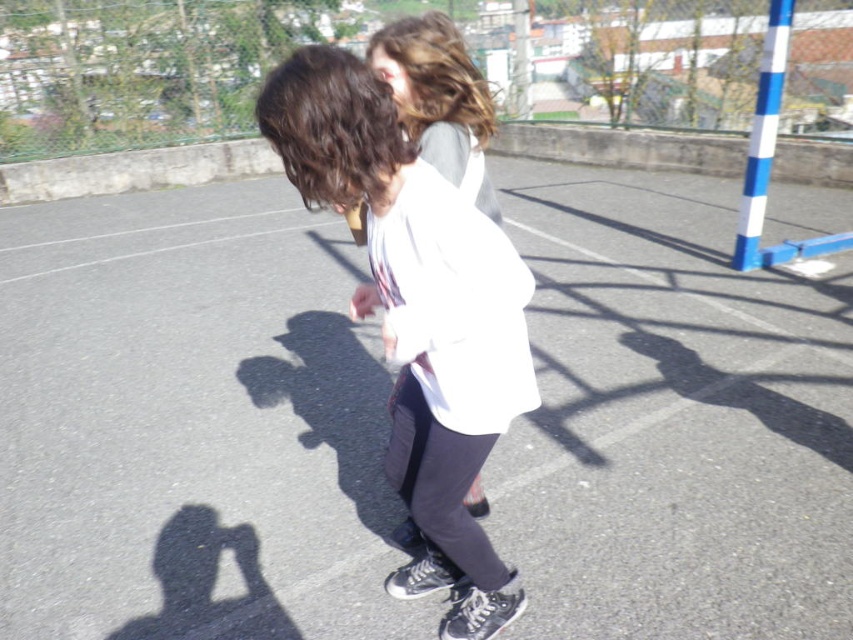
You are standing at point 0.0, 0.0 in the image coordinate system. You want to walk to the white matte jacket at center. Which direction should you move in?

The white matte jacket at center is located at point (418, 316), so you should move northeast to reach it.

You are designing a costume for a play and need to ensure that the white matte jacket at center and white fabric at center can be worn together. Based on the image, which of these two items is wider so that they can be layered appropriately?

The white matte jacket at center is wider than the white fabric at center, so it should be worn over the white fabric at center for proper layering.

You are designing a costume for a theater production and need to decide which item to use as the main outfit. Given the scene described, which object between the white matte jacket at center and the white fabric at center would you choose if you want the main outfit to be more prominent in size?

The white matte jacket at center has a larger size compared to the white fabric at center, so you should choose the white matte jacket at center as the main outfit to ensure it stands out more in size.